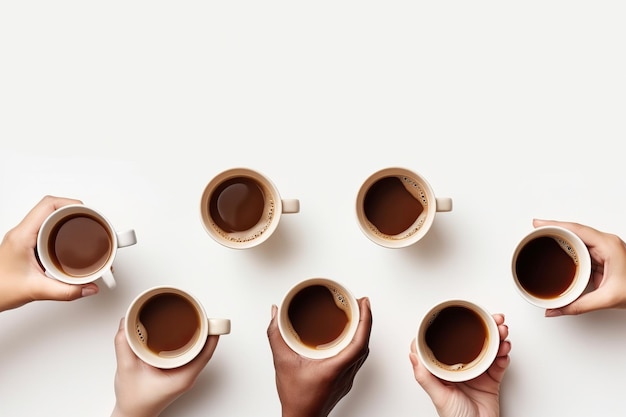
Where is `mugs`? mugs is located at coordinates (587, 277), (424, 230), (279, 211), (126, 239), (212, 325), (356, 311), (486, 354).